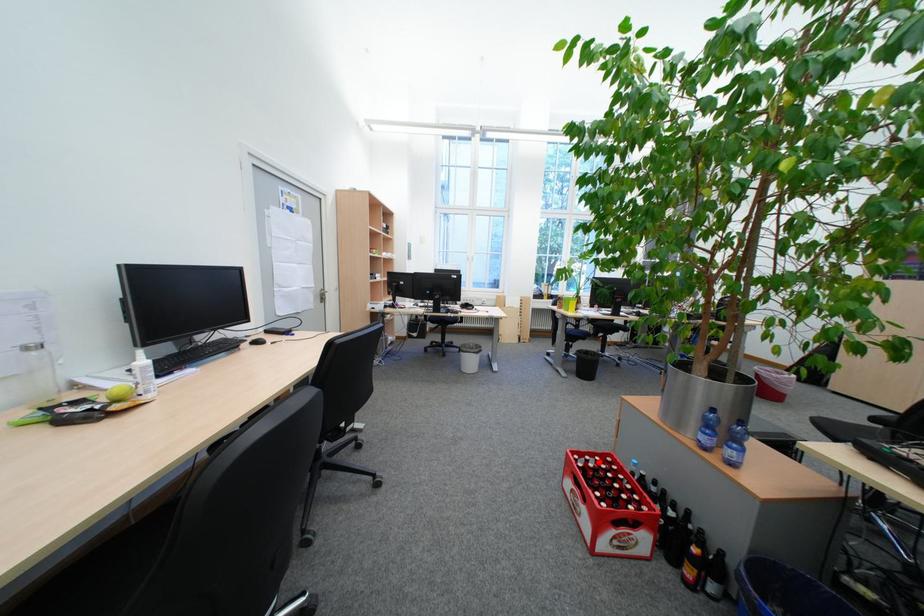
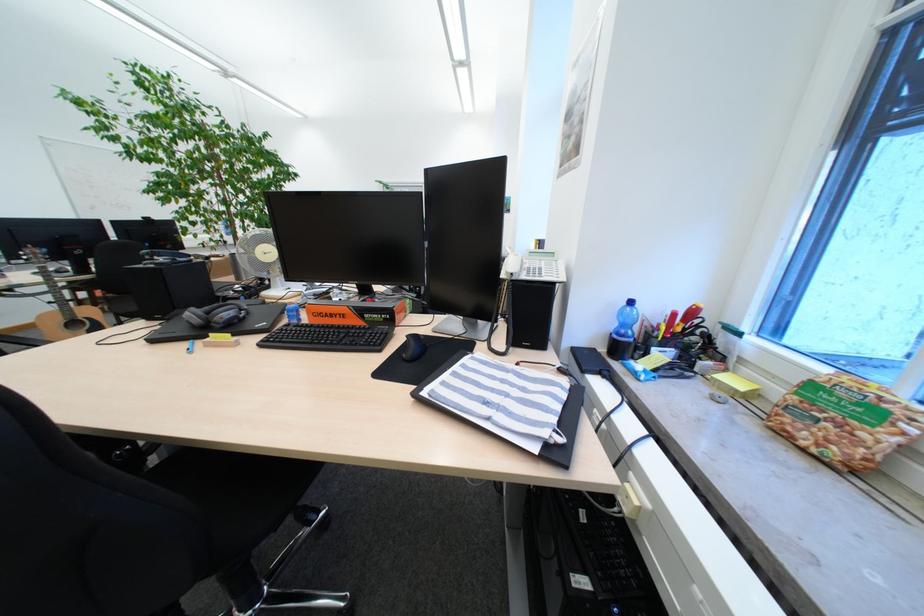
Question: I am providing you with two images of the same scene from different viewpoints. A red point is marked on the first image. Is the red point's position out of view in image 2?

Choices:
 (A) Yes
 (B) No

Answer: (A)